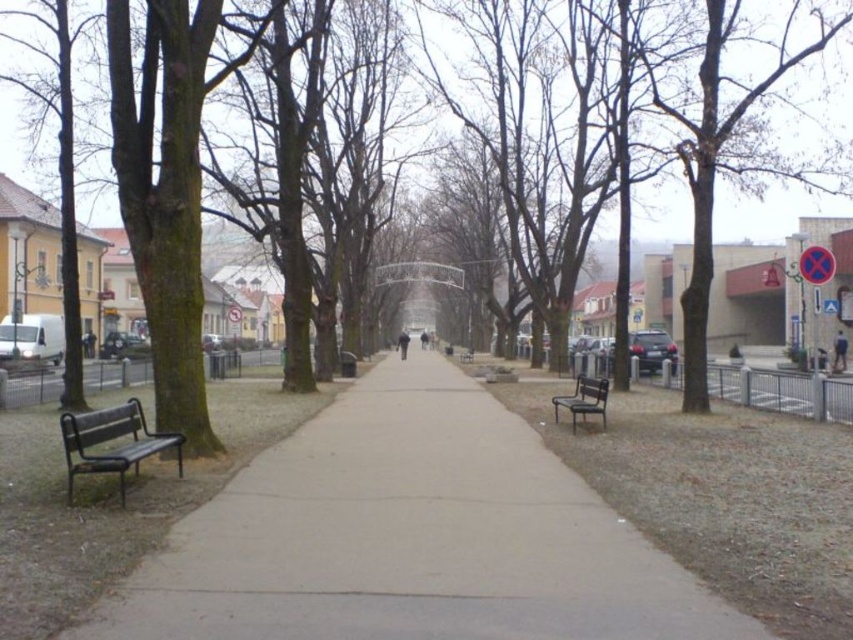
Question: Among these objects, which one is farthest from the camera?

Choices:
 (A) metallic black bench at left
 (B) brown rough tree at left
 (C) concrete sidewalk at center

Answer: (B)

Question: Does brown rough tree at left lie behind metallic black bench at left?

Choices:
 (A) no
 (B) yes

Answer: (B)

Question: Which point is closer to the camera?

Choices:
 (A) concrete sidewalk at center
 (B) metallic silver bench at center
 (C) brown rough tree at left
 (D) wooden bench at center

Answer: (A)

Question: Does concrete sidewalk at center have a greater width compared to metallic silver bench at center?

Choices:
 (A) no
 (B) yes

Answer: (B)

Question: Is concrete sidewalk at center bigger than metallic black bench at left?

Choices:
 (A) no
 (B) yes

Answer: (B)

Question: Estimate the real-world distances between objects in this image. Which object is farther from the concrete sidewalk at center?

Choices:
 (A) wooden bench at center
 (B) metallic silver bench at center
 (C) brown rough tree at left

Answer: (A)